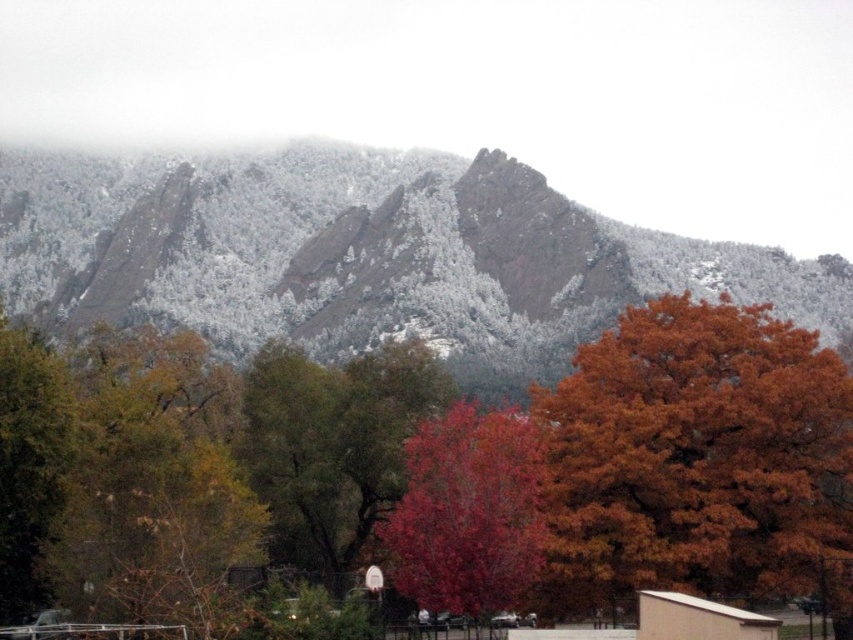
You are an artist painting the landscape and want to ensure the orange leafy tree at center right and the shiny red tree at center are positioned correctly. According to the scene, which tree should be placed higher in your painting?

The orange leafy tree at center right should be placed higher in the painting because it is positioned above the shiny red tree at center according to the description.